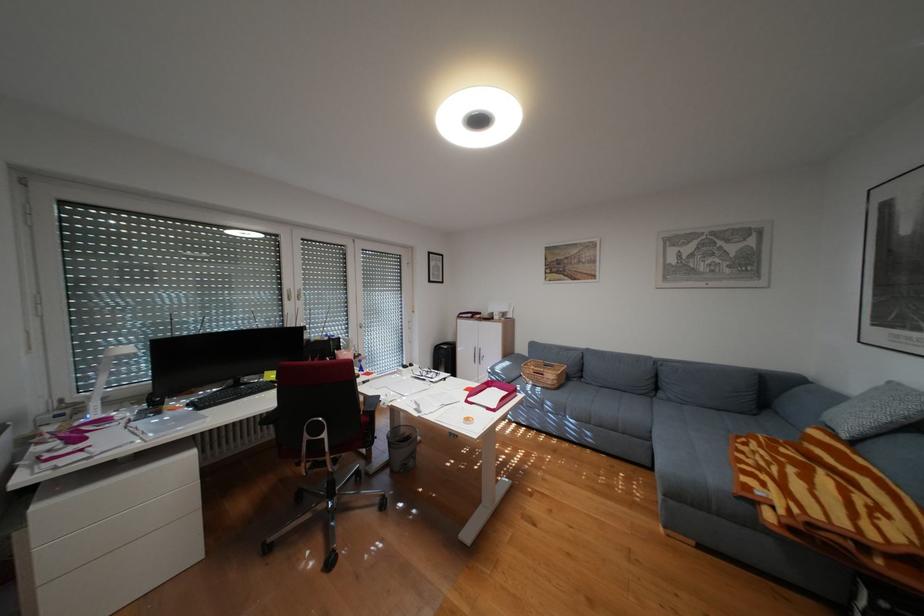
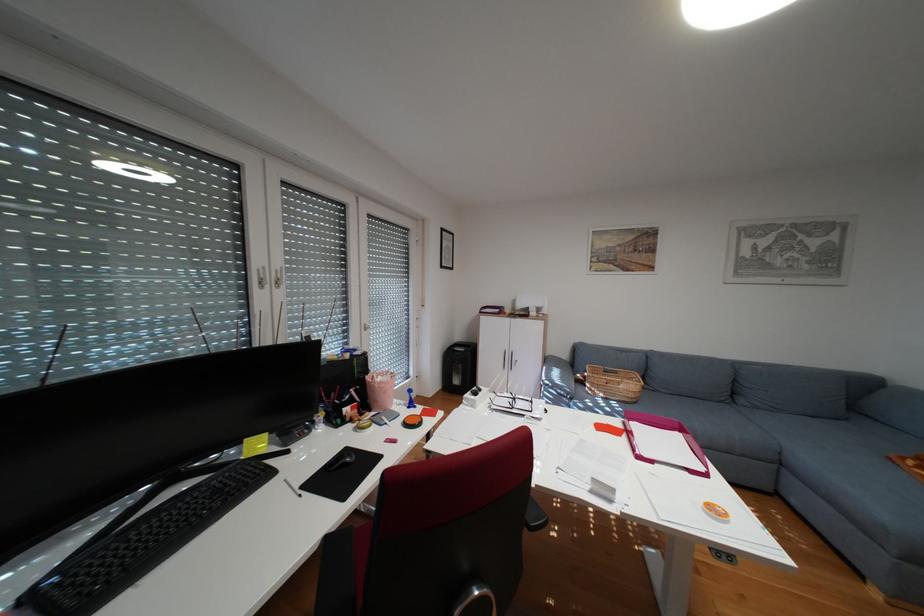
Looking at this image, in a continuous first-person perspective shot, in which direction is the camera moving?

The movement direction of the cameraman is left, forward.